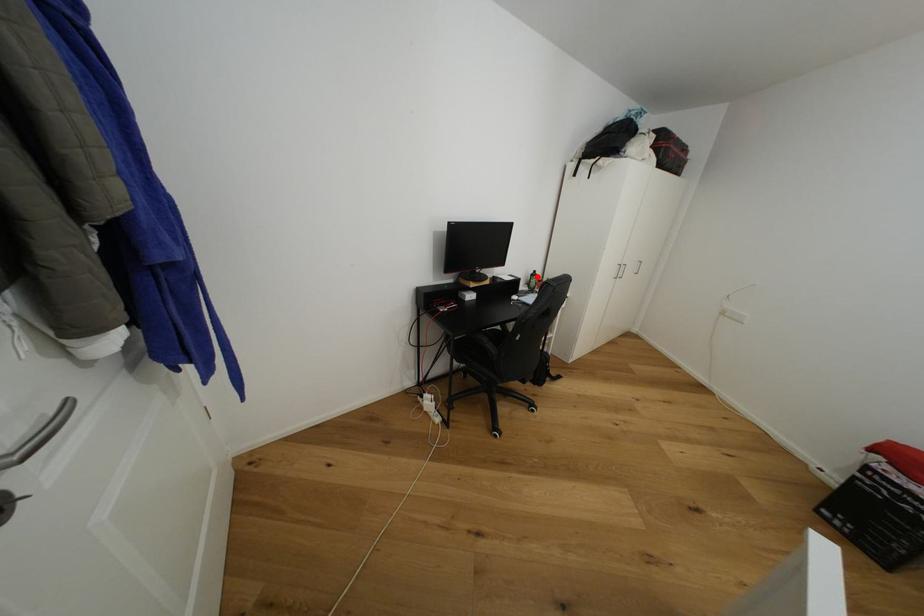
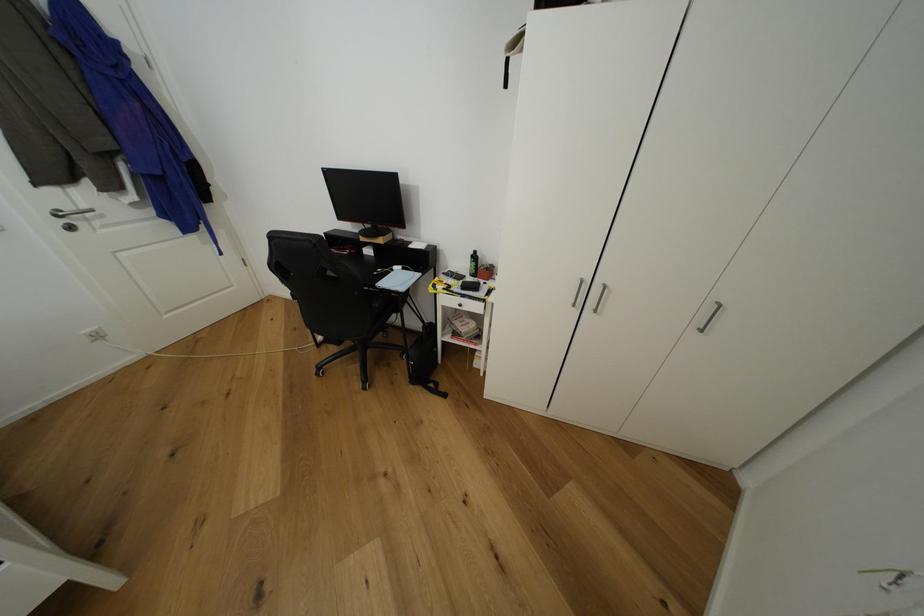
The point at the highlighted location is marked in the first image. Where is the corresponding point in the second image?

(478, 257)